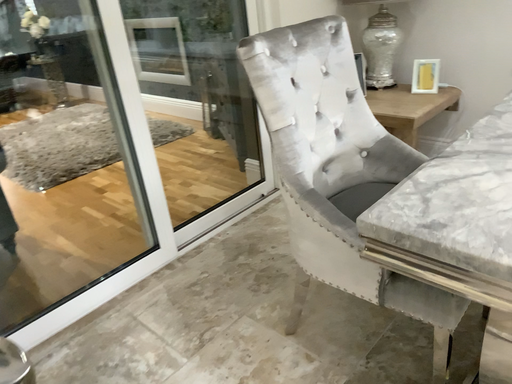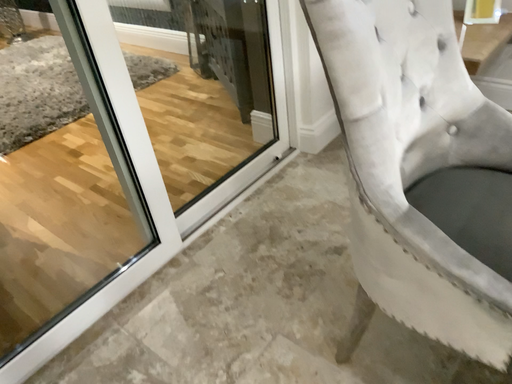
Question: Which way did the camera rotate in the video?

Choices:
 (A) rotated upward
 (B) rotated downward

Answer: (B)